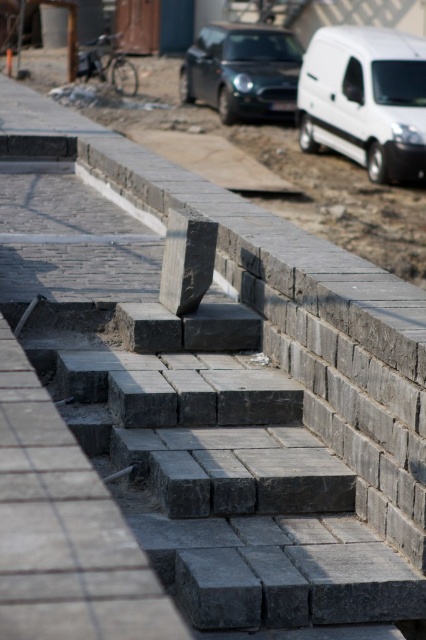
Is white matte van at upper right to the left of metallic silver car at center from the viewer's perspective?

No, white matte van at upper right is not to the left of metallic silver car at center.

Which is in front, point (416, 68) or point (276, 113)?

Point (416, 68) is in front.

Identify the location of white matte van at upper right. (365, 99).